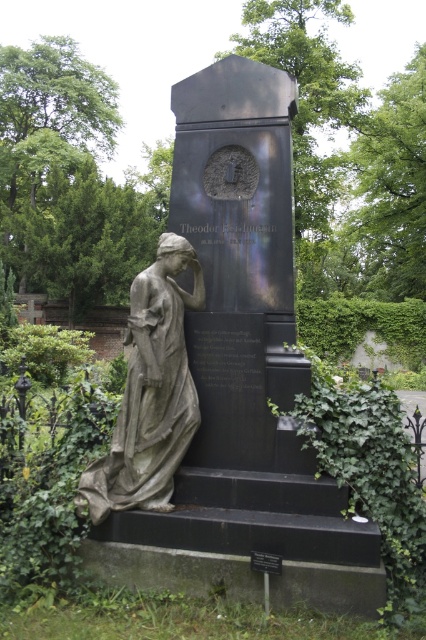
Is gray stone statue at center closer to camera compared to gray stone statue at left?

No, gray stone statue at center is further to the viewer.

Does gray stone statue at center have a greater height compared to gray stone statue at left?

Yes.

Identify the location of gray stone statue at center. The width and height of the screenshot is (426, 640). (241, 376).